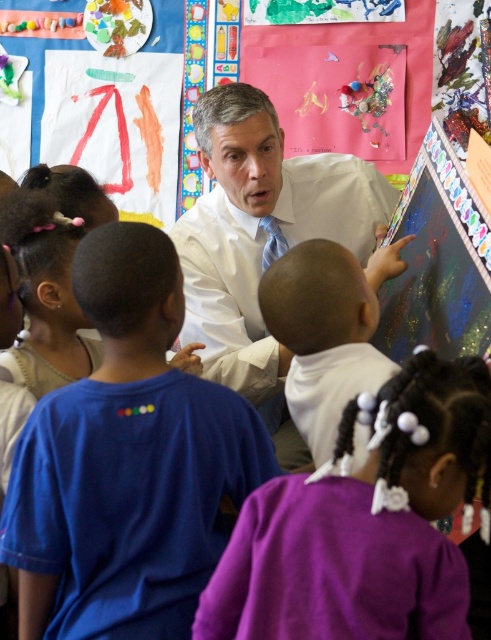
You are a student standing in the classroom and you see the purple fabric at lower center and the white matte shirt at center. Which object is closer to the bottom of the image?

The purple fabric at lower center is closer to the bottom of the image because it is shorter than the white matte shirt at center.

You are a student sitting at the back of the classroom. You notice the purple fabric at lower center and the white matte shirt at center. Which object is closer to the bottom edge of the image?

The purple fabric at lower center is closer to the bottom edge of the image because it is positioned below the white matte shirt at center.